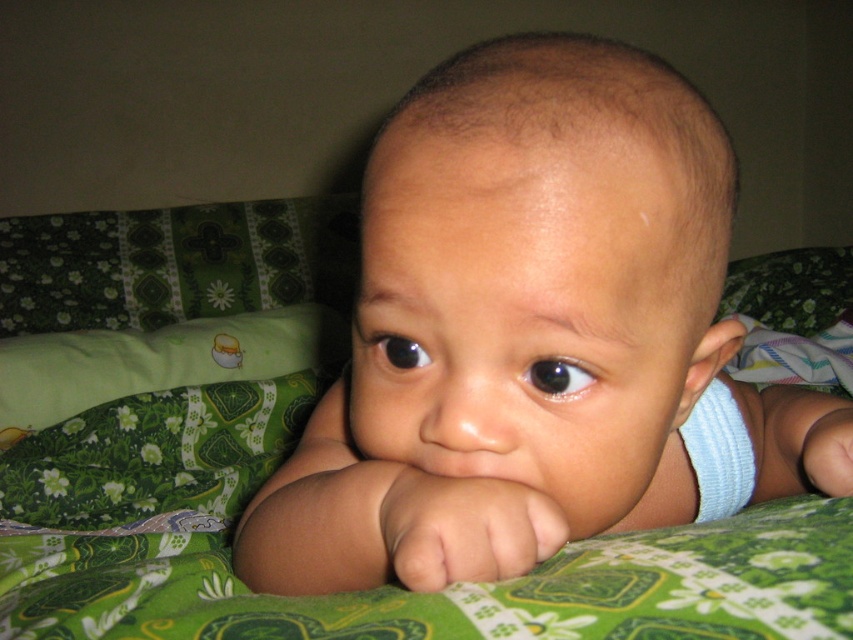
Which is above, smooth skin baby at center or green fabric pillow at center?

smooth skin baby at center

Can you confirm if smooth skin baby at center is positioned to the right of green fabric pillow at center?

Indeed, smooth skin baby at center is positioned on the right side of green fabric pillow at center.

Locate an element on the screen. smooth skin baby at center is located at coordinates (535, 337).